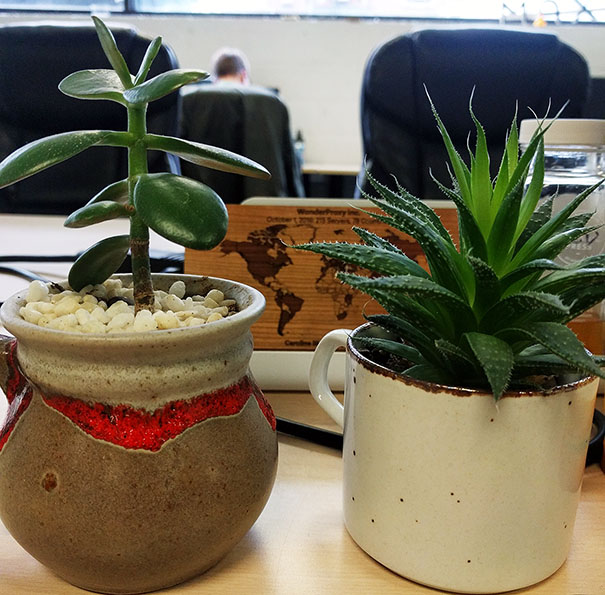
I want to click on pot, so click(x=155, y=405).